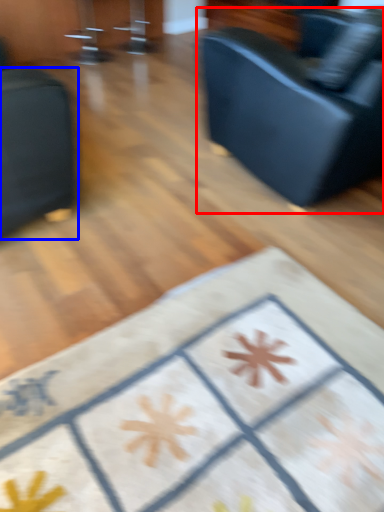
Question: Which point is further to the camera, studio couch (highlighted by a red box) or furniture (highlighted by a blue box)?

Choices:
 (A) studio couch
 (B) furniture

Answer: (A)